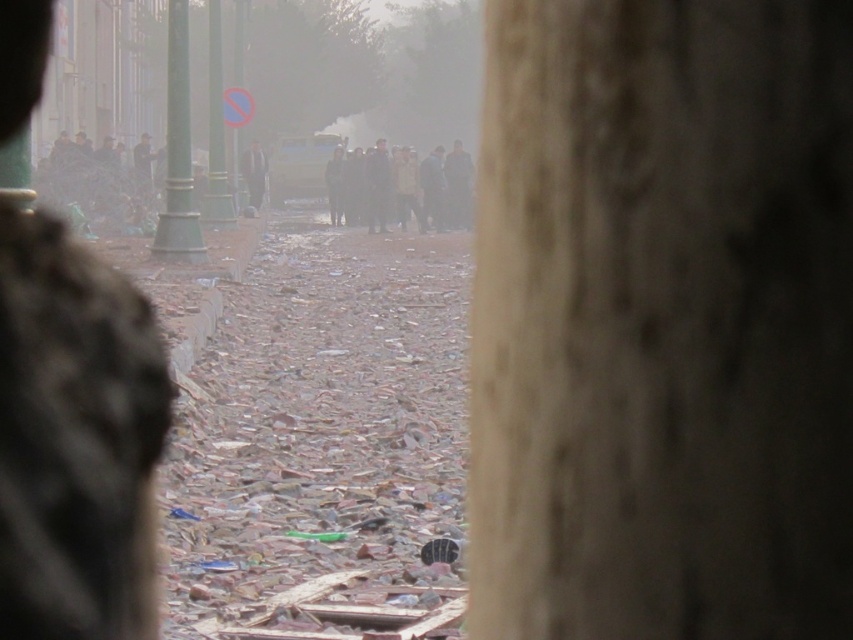
Can you confirm if smooth concrete pillar at center is positioned to the left of green polished metal pole at left?

No, smooth concrete pillar at center is not to the left of green polished metal pole at left.

Between point (581, 147) and point (186, 44), which one is positioned behind?

The point (186, 44) is behind.

Find the location of a particular element. The height and width of the screenshot is (640, 853). smooth concrete pillar at center is located at coordinates coord(662,321).

Does green polished metal pole at left have a larger size compared to dark gray clothing at center?

Actually, green polished metal pole at left might be smaller than dark gray clothing at center.

Does green polished metal pole at left appear over dark gray clothing at center?

Incorrect, green polished metal pole at left is not positioned above dark gray clothing at center.

Is point (181, 144) positioned behind point (438, 211)?

No, it is not.

Image resolution: width=853 pixels, height=640 pixels. Identify the location of green polished metal pole at left. (178, 150).

Is broken glass shards at center thinner than green metallic pole at upper center?

Incorrect, broken glass shards at center's width is not less than green metallic pole at upper center's.

Is point (169, 621) in front of point (212, 33)?

Yes, it is in front of point (212, 33).

What do you see at coordinates (318, 429) in the screenshot?
I see `broken glass shards at center` at bounding box center [318, 429].

Where is `broken glass shards at center`? The image size is (853, 640). broken glass shards at center is located at coordinates (318, 429).